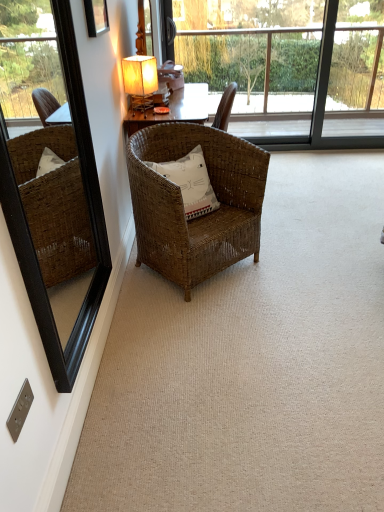
Question: Can you confirm if matte beige fabric table lamp at upper center is shorter than woven brown chair at center?

Choices:
 (A) no
 (B) yes

Answer: (B)

Question: Is matte beige fabric table lamp at upper center located outside woven brown chair at center?

Choices:
 (A) no
 (B) yes

Answer: (B)

Question: Is matte beige fabric table lamp at upper center behind woven brown chair at center?

Choices:
 (A) yes
 (B) no

Answer: (A)

Question: Is matte beige fabric table lamp at upper center not near woven brown chair at center?

Choices:
 (A) yes
 (B) no

Answer: (B)

Question: Does matte beige fabric table lamp at upper center appear on the left side of woven brown chair at center?

Choices:
 (A) yes
 (B) no

Answer: (A)

Question: From a real-world perspective, does matte beige fabric table lamp at upper center sit lower than woven brown chair at center?

Choices:
 (A) yes
 (B) no

Answer: (B)

Question: Does wooden picture frame at upper left have a greater height compared to white cotton pillow at center?

Choices:
 (A) yes
 (B) no

Answer: (A)

Question: Is wooden picture frame at upper left to the right of white cotton pillow at center from the viewer's perspective?

Choices:
 (A) no
 (B) yes

Answer: (A)

Question: Is wooden picture frame at upper left completely or partially outside of white cotton pillow at center?

Choices:
 (A) yes
 (B) no

Answer: (A)

Question: Can you confirm if wooden picture frame at upper left is shorter than white cotton pillow at center?

Choices:
 (A) yes
 (B) no

Answer: (B)

Question: Is white cotton pillow at center a part of wooden picture frame at upper left?

Choices:
 (A) no
 (B) yes

Answer: (A)

Question: Does wooden picture frame at upper left turn towards white cotton pillow at center?

Choices:
 (A) no
 (B) yes

Answer: (A)

Question: Is woven brown chair at center in front of black wood mirror at left?

Choices:
 (A) no
 (B) yes

Answer: (A)